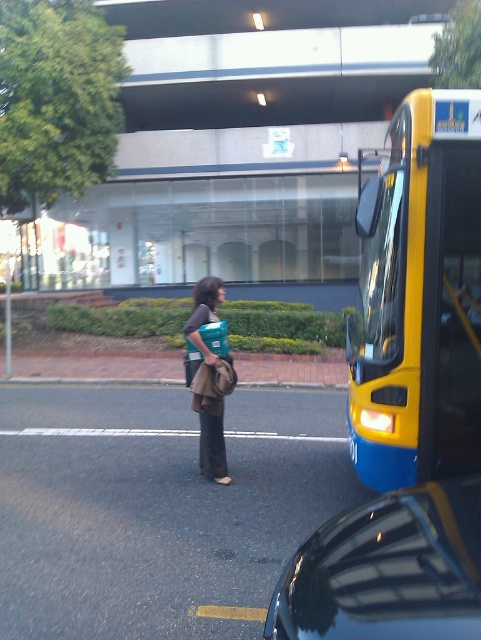
Can you confirm if yellow matte bus at right is taller than shiny black car at lower right?

In fact, yellow matte bus at right may be shorter than shiny black car at lower right.

Is yellow matte bus at right positioned in front of shiny black car at lower right?

No, it is behind shiny black car at lower right.

This screenshot has height=640, width=481. What do you see at coordinates (418, 298) in the screenshot? I see `yellow matte bus at right` at bounding box center [418, 298].

At what (x,y) coordinates should I click in order to perform the action: click on yellow matte bus at right. Please return your answer as a coordinate pair (x, y). Looking at the image, I should click on (418, 298).

Can you confirm if shiny black car at lower right is taller than teal fabric bag at center?

No.

Is shiny black car at lower right further to camera compared to teal fabric bag at center?

No, it is not.

Who is more forward, (480,620) or (215,472)?

Point (480,620)

Find the location of a particular element. Image resolution: width=481 pixels, height=640 pixels. shiny black car at lower right is located at coordinates (388, 570).

Does yellow matte bus at right have a larger size compared to teal fabric bag at center?

Actually, yellow matte bus at right might be smaller than teal fabric bag at center.

Between yellow matte bus at right and teal fabric bag at center, which one appears on the left side from the viewer's perspective?

Positioned to the left is teal fabric bag at center.

Is point (358, 419) positioned behind point (219, 442)?

No, (358, 419) is in front of (219, 442).

This screenshot has height=640, width=481. I want to click on yellow matte bus at right, so click(418, 298).